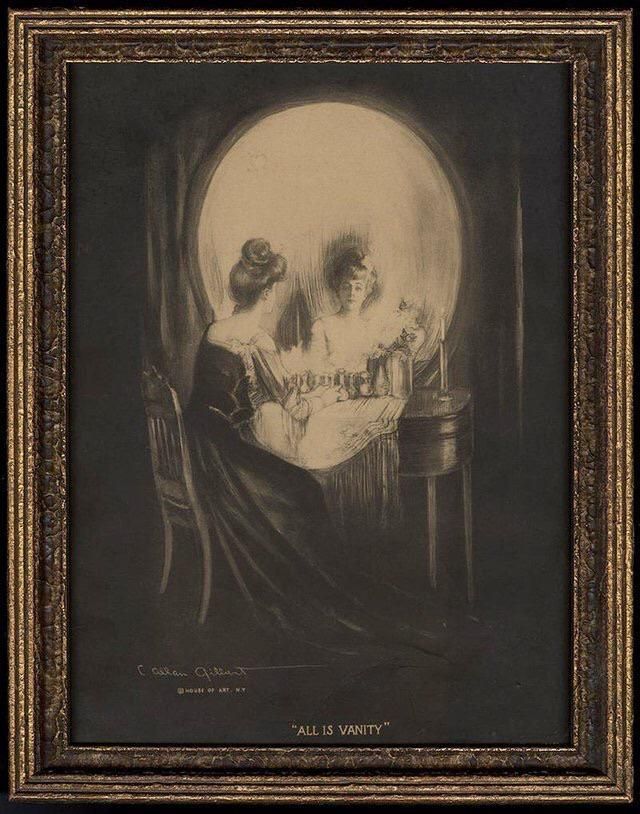
I want to click on painting, so click(x=408, y=556).